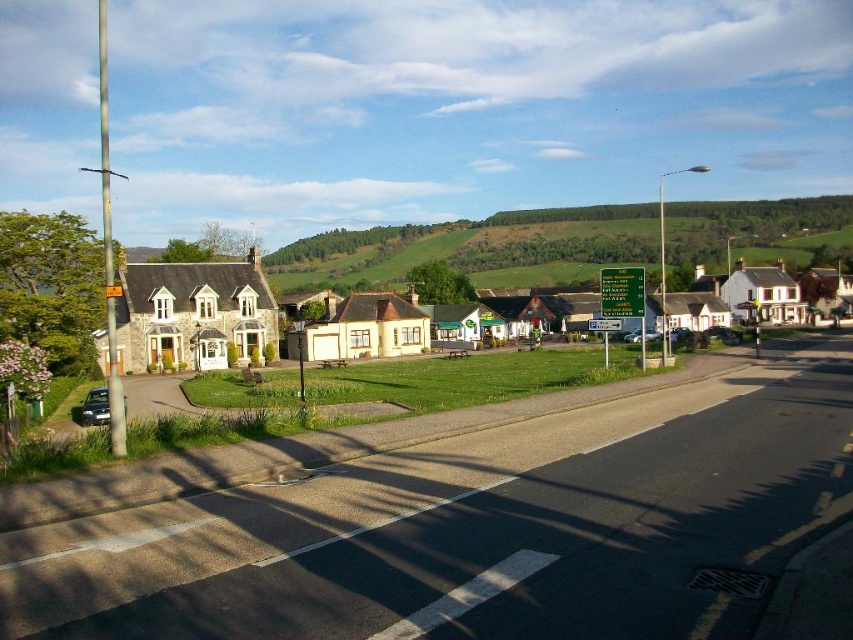
Question: Which object appears closest to the camera in this image?

Choices:
 (A) stone house at center
 (B) green grassy hillside at center
 (C) metallic silver car at lower left

Answer: (C)

Question: Which point appears farthest from the camera in this image?

Choices:
 (A) (680, 292)
 (B) (619, 323)

Answer: (A)

Question: Is green grassy hillside at center bigger than green plastic sign at upper center?

Choices:
 (A) no
 (B) yes

Answer: (B)

Question: Based on their relative distances, which object is farther from the green plastic sign at upper center?

Choices:
 (A) green plastic sign at center
 (B) metallic silver car at lower left

Answer: (B)

Question: Is stone house at center further to the viewer compared to green plastic sign at center?

Choices:
 (A) no
 (B) yes

Answer: (A)

Question: Does stone house at center appear on the right side of green plastic sign at upper center?

Choices:
 (A) yes
 (B) no

Answer: (A)